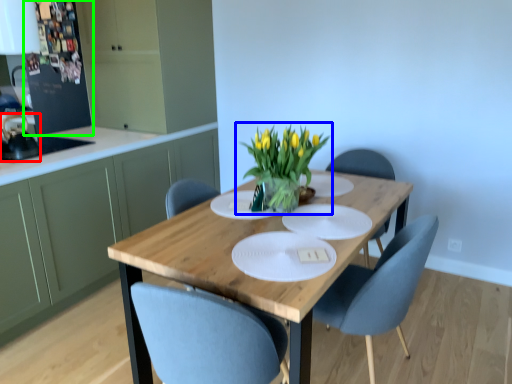
Question: Which object is positioned closest to appliance (highlighted by a red box)? Select from houseplant (highlighted by a blue box) and appliance (highlighted by a green box).

Choices:
 (A) houseplant
 (B) appliance

Answer: (B)